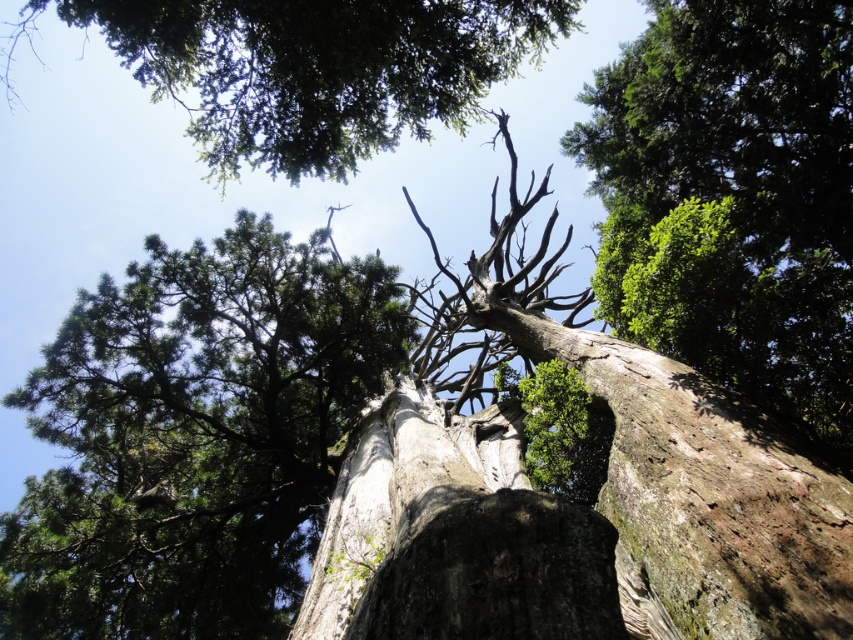
Question: Which point is closer to the camera?

Choices:
 (A) (274, 580)
 (B) (538, 1)

Answer: (B)

Question: Is green rough bark tree at center smaller than green rough bark tree at upper center?

Choices:
 (A) no
 (B) yes

Answer: (B)

Question: In this image, where is green rough bark tree at upper center located relative to dark gray rough rock at center?

Choices:
 (A) left
 (B) right

Answer: (A)

Question: Estimate the real-world distances between objects in this image. Which object is closer to the dark gray rough rock at center?

Choices:
 (A) green rough bark tree at upper right
 (B) green rough bark tree at upper center

Answer: (A)

Question: Which point is farther to the camera?

Choices:
 (A) (514, 634)
 (B) (384, 296)
 (C) (851, 353)

Answer: (B)

Question: Can you confirm if green rough bark tree at upper center is positioned to the left of dark gray rough rock at center?

Choices:
 (A) no
 (B) yes

Answer: (B)